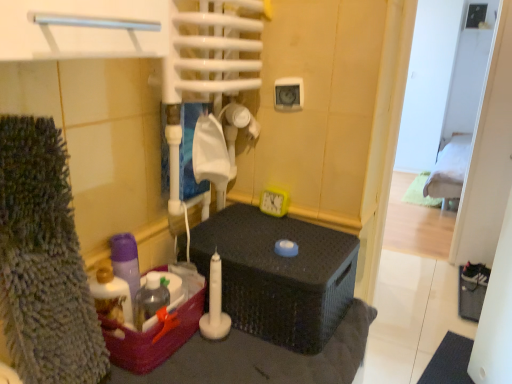
Question: Can you confirm if green fabric bed at upper right is wider than matte black wicker basket at center?

Choices:
 (A) yes
 (B) no

Answer: (B)

Question: Could you tell me if green fabric bed at upper right is facing matte black wicker basket at center?

Choices:
 (A) no
 (B) yes

Answer: (A)

Question: From the image's perspective, is green fabric bed at upper right on matte black wicker basket at center?

Choices:
 (A) no
 (B) yes

Answer: (B)

Question: Considering the relative positions of green fabric bed at upper right and matte black wicker basket at center in the image provided, is green fabric bed at upper right in front of matte black wicker basket at center?

Choices:
 (A) no
 (B) yes

Answer: (A)

Question: Does green fabric bed at upper right have a lesser width compared to matte black wicker basket at center?

Choices:
 (A) no
 (B) yes

Answer: (B)

Question: Considering the relative positions of green fabric bed at upper right and matte black wicker basket at center in the image provided, is green fabric bed at upper right behind matte black wicker basket at center?

Choices:
 (A) yes
 (B) no

Answer: (A)

Question: Considering the relative sizes of translucent plastic basket at lower left and green fabric bed at upper right in the image provided, is translucent plastic basket at lower left bigger than green fabric bed at upper right?

Choices:
 (A) yes
 (B) no

Answer: (B)

Question: Are translucent plastic basket at lower left and green fabric bed at upper right beside each other?

Choices:
 (A) no
 (B) yes

Answer: (A)

Question: Is translucent plastic basket at lower left smaller than green fabric bed at upper right?

Choices:
 (A) no
 (B) yes

Answer: (B)

Question: Is translucent plastic basket at lower left aimed at green fabric bed at upper right?

Choices:
 (A) no
 (B) yes

Answer: (A)

Question: From a real-world perspective, is translucent plastic basket at lower left on top of green fabric bed at upper right?

Choices:
 (A) yes
 (B) no

Answer: (A)

Question: Is translucent plastic basket at lower left shorter than green fabric bed at upper right?

Choices:
 (A) yes
 (B) no

Answer: (A)

Question: Does translucent plastic basket at lower left have a greater width compared to matte black wicker basket at center?

Choices:
 (A) yes
 (B) no

Answer: (B)